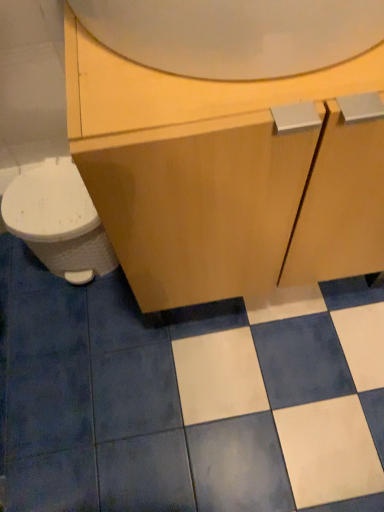
Question: Is white glossy tile at center positioned with its back to white glossy toilet at left?

Choices:
 (A) yes
 (B) no

Answer: (B)

Question: Is white glossy tile at center surrounding white glossy toilet at left?

Choices:
 (A) no
 (B) yes

Answer: (A)

Question: Can you confirm if white glossy tile at center is thinner than white glossy toilet at left?

Choices:
 (A) yes
 (B) no

Answer: (B)

Question: Is white glossy tile at center bigger than white glossy toilet at left?

Choices:
 (A) no
 (B) yes

Answer: (B)

Question: From a real-world perspective, is white glossy tile at center under white glossy toilet at left?

Choices:
 (A) no
 (B) yes

Answer: (B)

Question: Considering the relative positions of white glossy tile at center and white glossy toilet at left in the image provided, is white glossy tile at center in front of white glossy toilet at left?

Choices:
 (A) no
 (B) yes

Answer: (B)

Question: Does matte wood cabinet at center come in front of white glossy toilet at left?

Choices:
 (A) no
 (B) yes

Answer: (B)

Question: Does matte wood cabinet at center appear on the right side of white glossy toilet at left?

Choices:
 (A) yes
 (B) no

Answer: (A)

Question: Considering the relative positions of matte wood cabinet at center and white glossy toilet at left in the image provided, is matte wood cabinet at center to the left of white glossy toilet at left from the viewer's perspective?

Choices:
 (A) no
 (B) yes

Answer: (A)

Question: Considering the relative sizes of matte wood cabinet at center and white glossy toilet at left in the image provided, is matte wood cabinet at center thinner than white glossy toilet at left?

Choices:
 (A) yes
 (B) no

Answer: (B)

Question: Is matte wood cabinet at center turned away from white glossy toilet at left?

Choices:
 (A) no
 (B) yes

Answer: (A)

Question: From a real-world perspective, is matte wood cabinet at center beneath white glossy toilet at left?

Choices:
 (A) yes
 (B) no

Answer: (B)

Question: Does white glossy toilet at left have a greater height compared to matte wood cabinet at center?

Choices:
 (A) no
 (B) yes

Answer: (A)